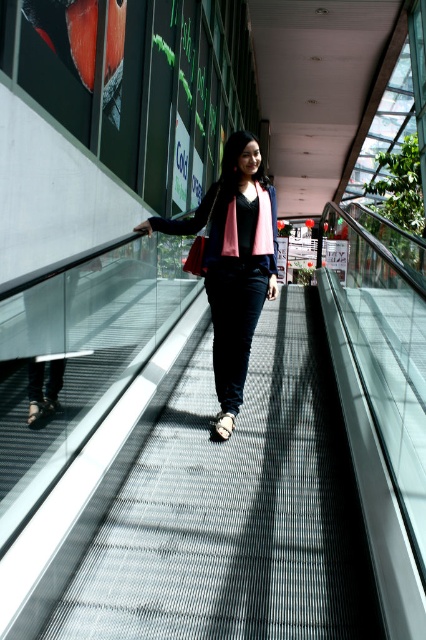
In the scene shown: Based on the scene described, where is the metallic gray escalator at center located in relation to the matte black jacket at center?

The metallic gray escalator at center is to the right of the matte black jacket at center.

You are standing at the entrance of the building and see the metallic gray escalator at center and the matte black jacket at center. Which object is closer to you?

The metallic gray escalator at center is closer to you because it is in front of the matte black jacket at center.

You are a delivery person carrying a box that is 2 meters wide. You need to walk through the area near the metallic gray escalator at center. Will your box fit through the space available?

The metallic gray escalator at center is 2.21 meters from camera. Since the box is 2 meters wide, it will fit through the space as the distance is greater than the box width.